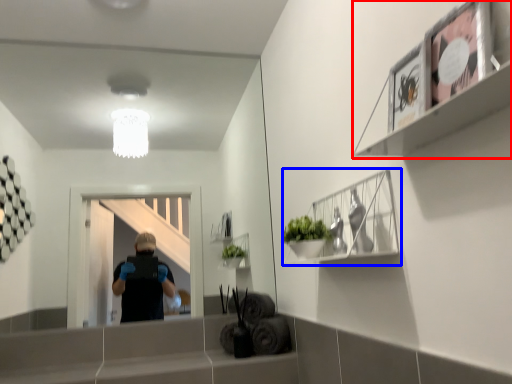
Question: Among these objects, which one is nearest to the camera, shelf (highlighted by a red box) or cabinet (highlighted by a blue box)?

Choices:
 (A) shelf
 (B) cabinet

Answer: (A)